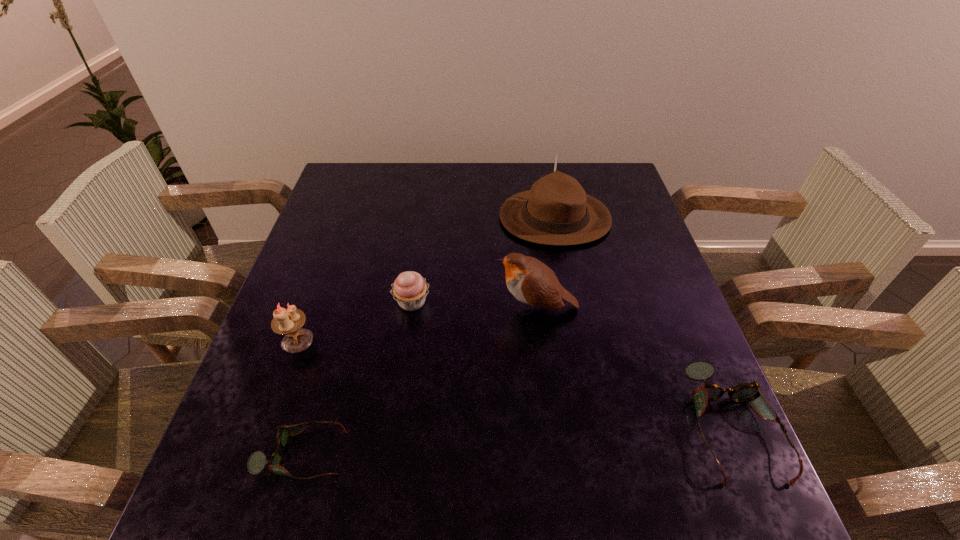
The height and width of the screenshot is (540, 960). What are the coordinates of `vacant space at the near right corner` in the screenshot? It's located at (683, 427).

Where is `vacant area that lies between the farthest object and the fourth tallest object`? vacant area that lies between the farthest object and the fourth tallest object is located at coordinates tap(484, 260).

You are a GUI agent. You are given a task and a screenshot of the screen. Output one action in this format:
    pyautogui.click(x=<x>, y=<y>)
    Task: Click on the vacant area that lies between the taller spectacles and the fourth farthest object
    The image size is (960, 540).
    Given the screenshot: What is the action you would take?
    point(515,382)

Find the location of a particular element. Image resolution: width=960 pixels, height=540 pixels. empty space between the fedora and the second shortest object is located at coordinates (643, 321).

This screenshot has width=960, height=540. Find the location of `blank region between the bird and the fourth tallest object`. blank region between the bird and the fourth tallest object is located at coordinates (474, 305).

Locate an element on the screen. The image size is (960, 540). vacant area that lies between the fedora and the bird is located at coordinates (545, 263).

This screenshot has width=960, height=540. I want to click on vacant space that's between the third nearest object and the bird, so click(417, 324).

Identify the location of free spot between the bird and the fourth object from right to left. (474, 305).

Where is `free spot between the third object from left to right and the farthest object`? This screenshot has width=960, height=540. free spot between the third object from left to right and the farthest object is located at coordinates (484, 260).

Where is `empty space between the fifth tallest object and the third nearest object`? The width and height of the screenshot is (960, 540). empty space between the fifth tallest object and the third nearest object is located at coordinates (515, 382).